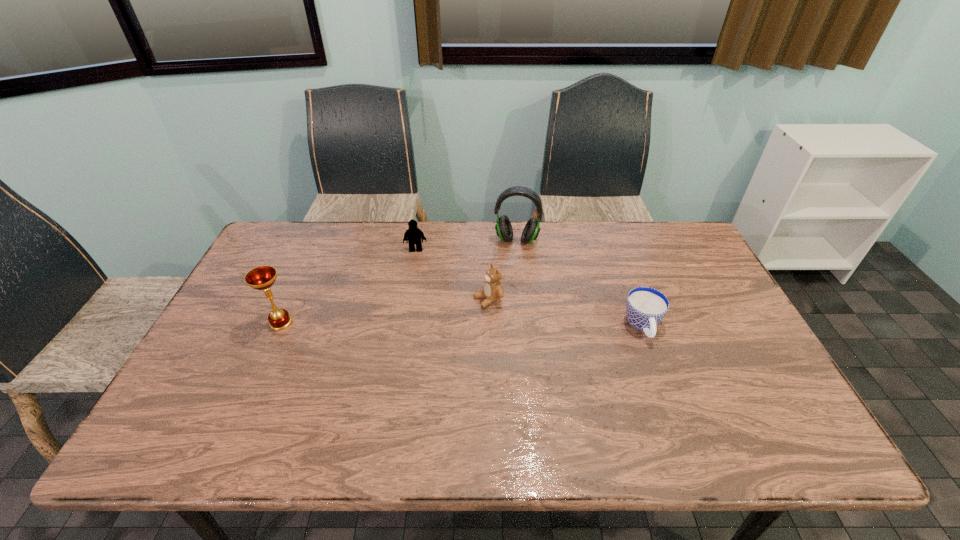
The image size is (960, 540). I want to click on chalice, so click(x=263, y=277).

Identify the location of cup. (645, 307).

Where is `the shortest object`? The image size is (960, 540). the shortest object is located at coordinates (645, 307).

Find the location of a particular element. The image size is (960, 540). teddy bear is located at coordinates (493, 290).

Identify the location of Lego. (413, 235).

Locate an element on the screen. headset is located at coordinates (x=503, y=227).

This screenshot has height=540, width=960. What are the coordinates of `vacant region located on the right of the chalice` in the screenshot? It's located at (330, 322).

This screenshot has width=960, height=540. Identify the location of vacant space located 0.150m on the side of the shortest object with the handle. (667, 395).

Locate an element on the screen. vacant space positioned on the front-facing side of the teddy bear is located at coordinates point(415,328).

Locate an element on the screen. Image resolution: width=960 pixels, height=540 pixels. free space located 0.350m on the front-facing side of the teddy bear is located at coordinates (358, 350).